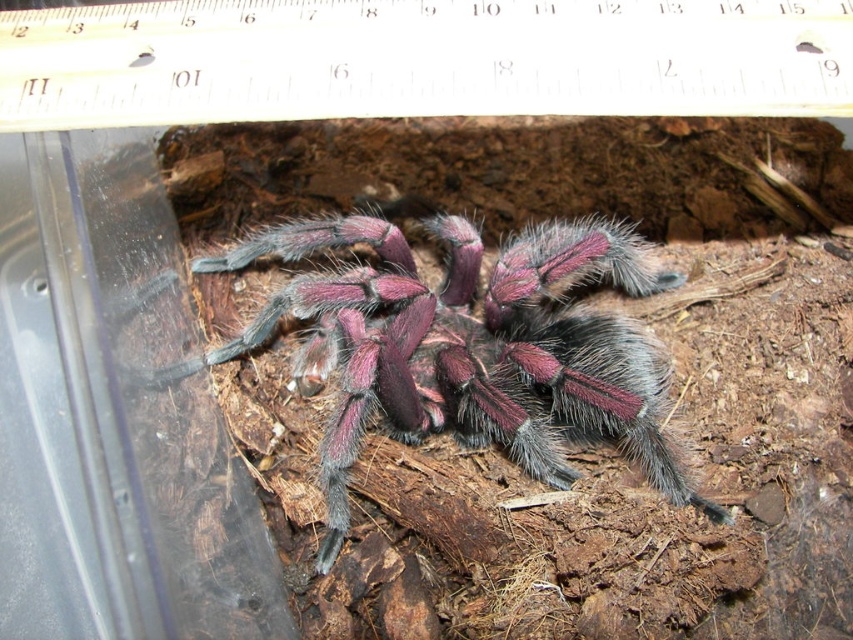
You are a researcher measuring the length of the fuzzy purple spider at center. You have a white plastic ruler at upper center. Can you use the ruler to accurately measure the spider?

The white plastic ruler at upper center is shorter than the fuzzy purple spider at center, so the ruler cannot fully measure the spider since it is not long enough.

You are a researcher observing the tarantula in its enclosure. You notice the white plastic ruler at upper center and the fuzzy purple spider at center. Which object is closer to you?

The white plastic ruler at upper center is closer to you because it is in front of the fuzzy purple spider at center.